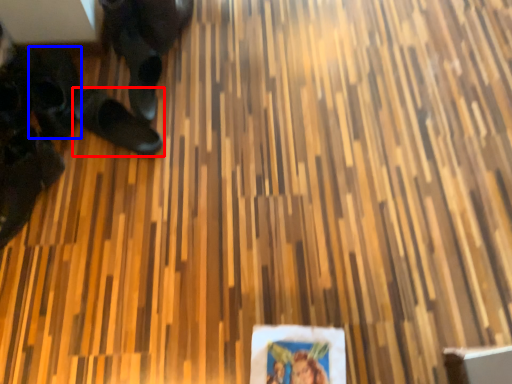
Question: Which of the following is the closest to the observer, footwear (highlighted by a red box) or footwear (highlighted by a blue box)?

Choices:
 (A) footwear
 (B) footwear

Answer: (A)